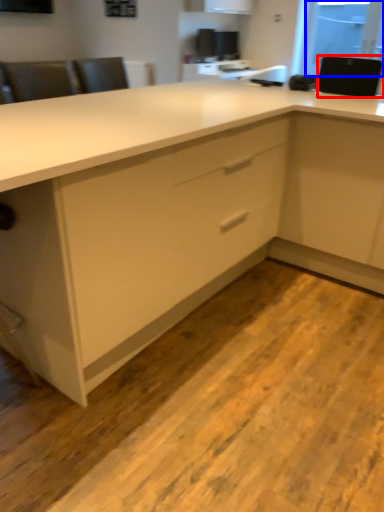
Question: Among these objects, which one is farthest to the camera, appliance (highlighted by a red box) or window screen (highlighted by a blue box)?

Choices:
 (A) appliance
 (B) window screen

Answer: (B)